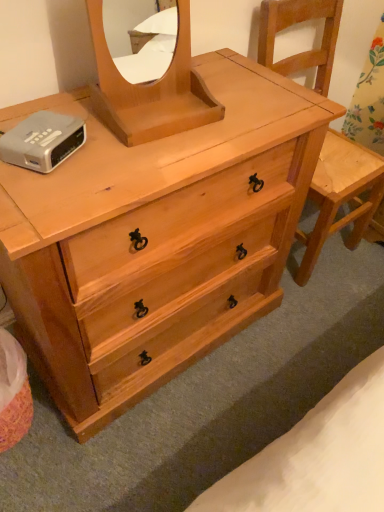
Identify the location of vacant area that is in front of natural wood mirror at center. Image resolution: width=384 pixels, height=512 pixels. (138, 165).